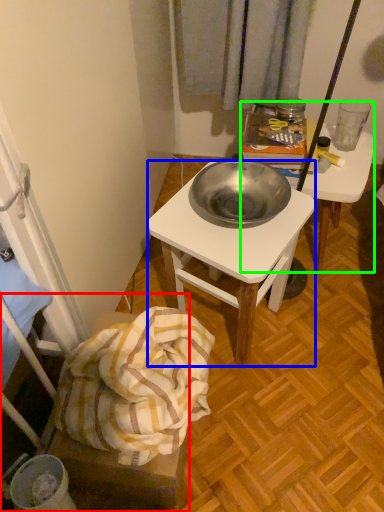
Question: Based on their relative distances, which object is nearer to furniture (highlighted by a red box)? Choose from desk (highlighted by a blue box) and desk (highlighted by a green box).

Choices:
 (A) desk
 (B) desk

Answer: (A)